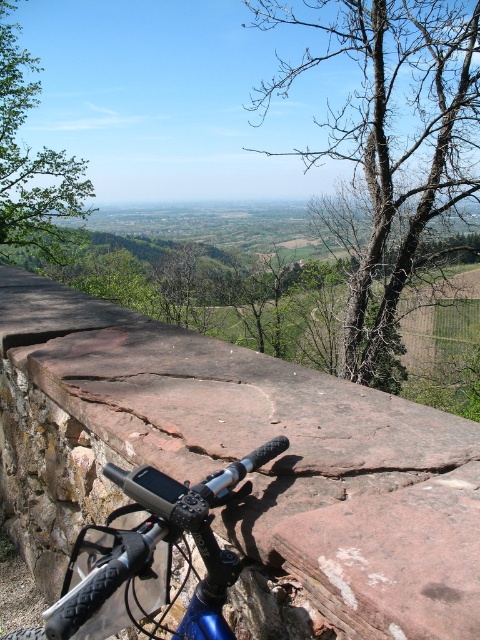
You are a hiker planning to set up a tent between the bare wood tree at upper right and the green leafy tree at upper left. The tent requires a minimum of 30 feet of space. Can you determine if there is enough space between them to set up your tent?

The distance between the bare wood tree at upper right and the green leafy tree at upper left is 34.82 feet, which exceeds the required 30 feet. Therefore, there is sufficient space to set up the tent between them.